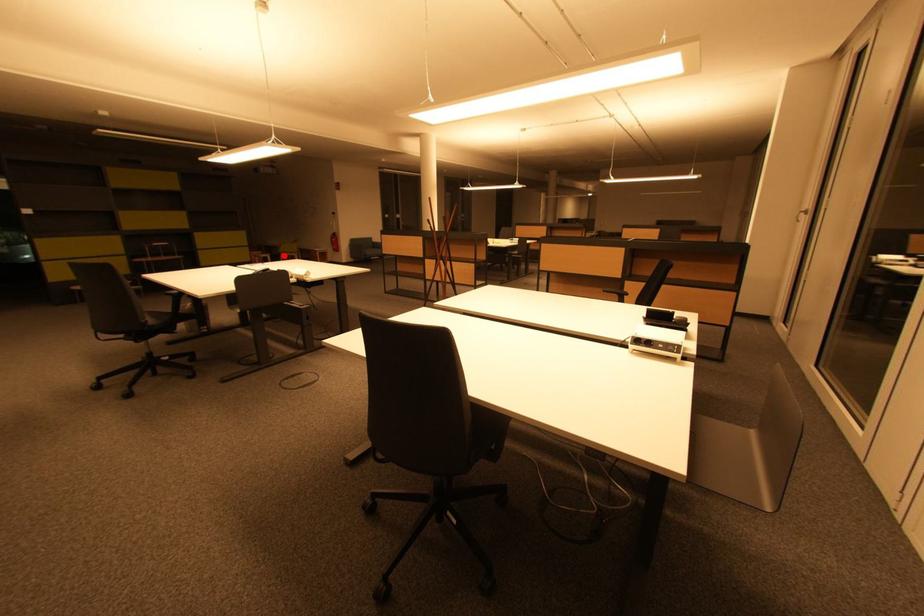
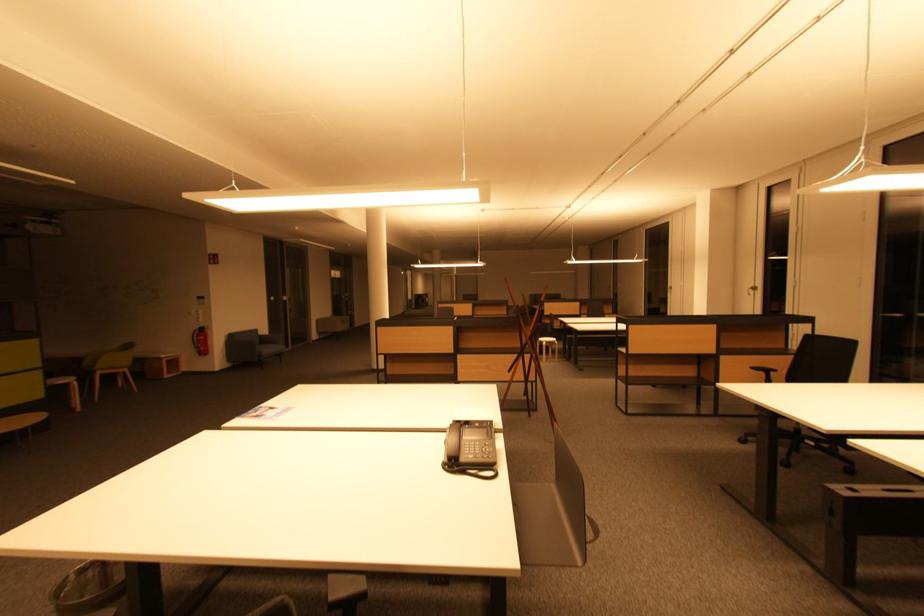
Question: I am providing you with two images of the same scene from different viewpoints. In image1, a red point is highlighted. Considering the same 3D point in image2, which of the following is correct?

Choices:
 (A) It is closer
 (B) It is farther

Answer: (B)